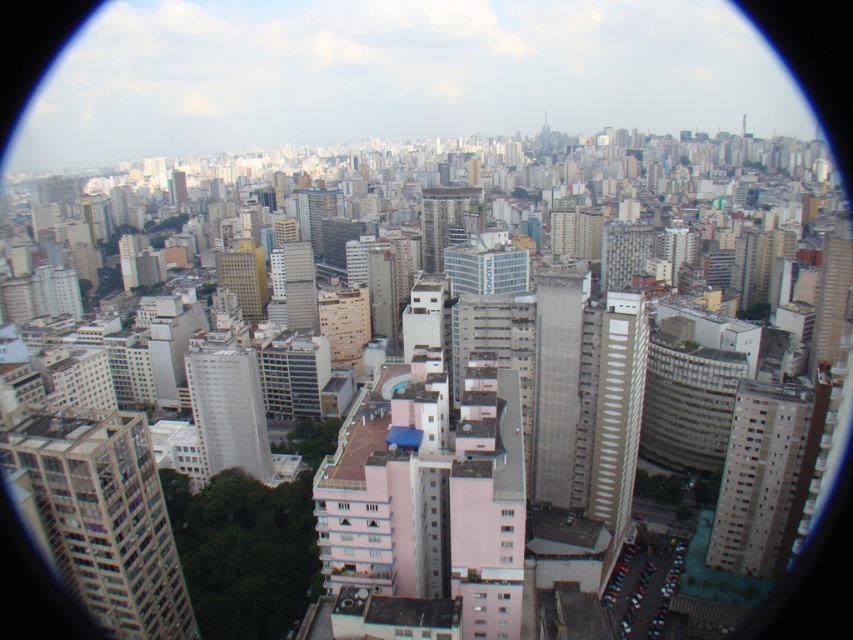
You are an architect analyzing the city layout. You notice two key buildings in the center of the image. Which one is located to the right of the other? The gray concrete building at center and the white smooth building at center are both in your view. Please identify their relative positions.

The gray concrete building at center is positioned on the right side of the white smooth building at center, so the gray concrete building at center is to the right of the white smooth building at center.